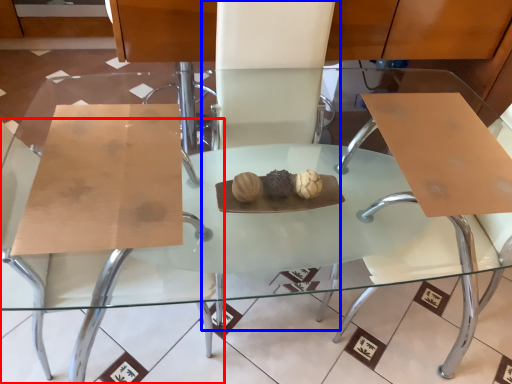
Question: Which of the following is the closest to the observer, chair (highlighted by a red box) or chair (highlighted by a blue box)?

Choices:
 (A) chair
 (B) chair

Answer: (A)